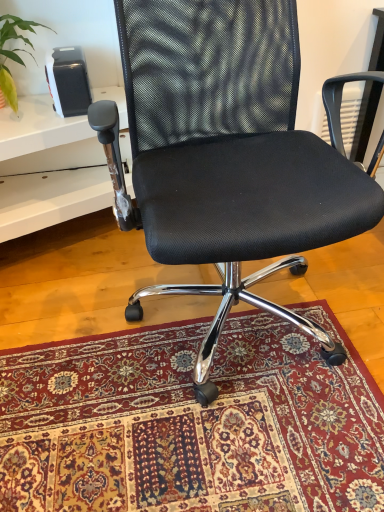
This screenshot has width=384, height=512. Identify the location of black mesh office chair at center. (226, 154).

Describe the element at coordinates (226, 154) in the screenshot. I see `black mesh office chair at center` at that location.

Measure the distance between carpeted rug at center and camera.

A distance of 89.54 centimeters exists between carpeted rug at center and camera.

What is the approximate height of white plastic table at left?

It is 36.31 centimeters.

Where is `black mesh office chair at center`? This screenshot has height=512, width=384. black mesh office chair at center is located at coordinates (226, 154).

From a real-world perspective, is carpeted rug at center over white plastic table at left?

Incorrect, from a real-world perspective, carpeted rug at center is lower than white plastic table at left.

Considering the relative sizes of carpeted rug at center and white plastic table at left in the image provided, is carpeted rug at center smaller than white plastic table at left?

Indeed, carpeted rug at center has a smaller size compared to white plastic table at left.

Is carpeted rug at center not inside white plastic table at left?

carpeted rug at center is positioned outside white plastic table at left.

From the image's perspective, is carpeted rug at center positioned above or below white plastic table at left?

Clearly, from the image's perspective, carpeted rug at center is below white plastic table at left.

Which of these two, black mesh office chair at center or green leafy plant at upper left, is thinner?

green leafy plant at upper left.

How many degrees apart are the facing directions of black mesh office chair at center and green leafy plant at upper left?

The angular difference between black mesh office chair at center and green leafy plant at upper left is 0.602 degrees.

Is black mesh office chair at center oriented towards green leafy plant at upper left?

No, black mesh office chair at center is not facing towards green leafy plant at upper left.

Considering the sizes of objects black mesh office chair at center and green leafy plant at upper left in the image provided, who is shorter, black mesh office chair at center or green leafy plant at upper left?

green leafy plant at upper left.

From a real-world perspective, does white plastic table at left stand above black mesh office chair at center?

No, from a real-world perspective, white plastic table at left is not on top of black mesh office chair at center.

In terms of height, does white plastic table at left look taller or shorter compared to black mesh office chair at center?

Clearly, white plastic table at left is shorter compared to black mesh office chair at center.

Considering their positions, is white plastic table at left located in front of or behind black mesh office chair at center?

white plastic table at left is positioned farther from the viewer than black mesh office chair at center.

Is black mesh office chair at center oriented towards carpeted rug at center?

No, black mesh office chair at center is not oriented towards carpeted rug at center.

The height and width of the screenshot is (512, 384). I want to click on mat below the black mesh office chair at center (from a real-world perspective), so click(191, 422).

How many degrees apart are the facing directions of black mesh office chair at center and carpeted rug at center?

They differ by 87.7 degrees in their facing directions.

From a real-world perspective, does black mesh office chair at center sit lower than carpeted rug at center?

No.

From the picture: How much distance is there between carpeted rug at center and green leafy plant at upper left?

carpeted rug at center and green leafy plant at upper left are 1.17 meters apart from each other.

Does carpeted rug at center have a lesser height compared to green leafy plant at upper left?

Yes, carpeted rug at center is shorter than green leafy plant at upper left.

Does carpeted rug at center turn towards green leafy plant at upper left?

No, carpeted rug at center is not aimed at green leafy plant at upper left.

The height and width of the screenshot is (512, 384). I want to click on mat that appears in front of the green leafy plant at upper left, so click(191, 422).

Is white plastic table at left at the back of black mesh office chair at center?

No, black mesh office chair at center is not facing away from white plastic table at left.

Where is `table on the left of black mesh office chair at center`? table on the left of black mesh office chair at center is located at coordinates [50, 200].

Considering the relative positions of black mesh office chair at center and white plastic table at left in the image provided, is black mesh office chair at center to the right of white plastic table at left from the viewer's perspective?

Yes.

Is point (345, 227) positioned behind point (50, 183)?

That is False.

Is green leafy plant at upper left to the left of carpeted rug at center from the viewer's perspective?

Correct, you'll find green leafy plant at upper left to the left of carpeted rug at center.

Who is smaller, green leafy plant at upper left or carpeted rug at center?

green leafy plant at upper left is smaller.

Is green leafy plant at upper left further to the viewer compared to carpeted rug at center?

Yes, green leafy plant at upper left is behind carpeted rug at center.

From the picture: How much distance is there between green leafy plant at upper left and carpeted rug at center?

green leafy plant at upper left is 3.84 feet from carpeted rug at center.

Locate an element on the screen. The height and width of the screenshot is (512, 384). mat below the white plastic table at left (from the image's perspective) is located at coordinates (191, 422).

Where is `chair in front of the green leafy plant at upper left`? chair in front of the green leafy plant at upper left is located at coordinates pos(226,154).

When comparing their distances from carpeted rug at center, does black mesh office chair at center or white plastic table at left seem further?

white plastic table at left is positioned further to the anchor carpeted rug at center.

From the image, which object appears to be nearer to white plastic table at left, carpeted rug at center or black mesh office chair at center?

black mesh office chair at center lies closer to white plastic table at left than the other object.

Considering their positions, is carpeted rug at center positioned closer to green leafy plant at upper left than black mesh office chair at center?

Based on the image, black mesh office chair at center appears to be nearer to green leafy plant at upper left.

Estimate the real-world distances between objects in this image. Which object is further from black mesh office chair at center, green leafy plant at upper left or white plastic table at left?

green leafy plant at upper left is positioned further to the anchor black mesh office chair at center.

Consider the image. Looking at the image, which one is located further to white plastic table at left, green leafy plant at upper left or black mesh office chair at center?

Among the two, black mesh office chair at center is located further to white plastic table at left.

Estimate the real-world distances between objects in this image. Which object is further from black mesh office chair at center, white plastic table at left or carpeted rug at center?

carpeted rug at center is further to black mesh office chair at center.

Looking at the image, which one is located closer to carpeted rug at center, green leafy plant at upper left or white plastic table at left?

The object closer to carpeted rug at center is white plastic table at left.

When comparing their distances from green leafy plant at upper left, does white plastic table at left or black mesh office chair at center seem closer?

Among the two, white plastic table at left is located nearer to green leafy plant at upper left.

Where is `chair that lies between white plastic table at left and carpeted rug at center from top to bottom`? This screenshot has width=384, height=512. chair that lies between white plastic table at left and carpeted rug at center from top to bottom is located at coordinates (226, 154).

Find the location of a particular element. This screenshot has width=384, height=512. table between green leafy plant at upper left and carpeted rug at center in the up-down direction is located at coordinates (50, 200).

The image size is (384, 512). In order to click on table between green leafy plant at upper left and black mesh office chair at center in this screenshot , I will do `click(50, 200)`.

At what (x,y) coordinates should I click in order to perform the action: click on chair between green leafy plant at upper left and carpeted rug at center vertically. Please return your answer as a coordinate pair (x, y). The height and width of the screenshot is (512, 384). Looking at the image, I should click on (226, 154).